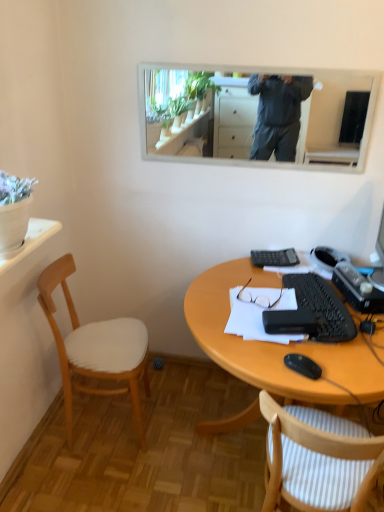
Identify the location of vacant area to the left of black plastic mouse at lower right. This screenshot has width=384, height=512. (258, 362).